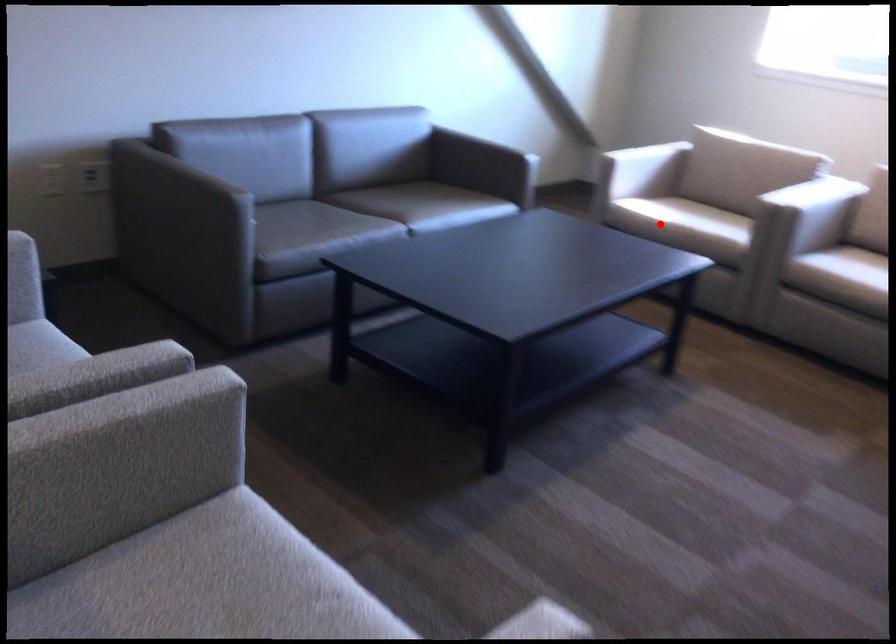
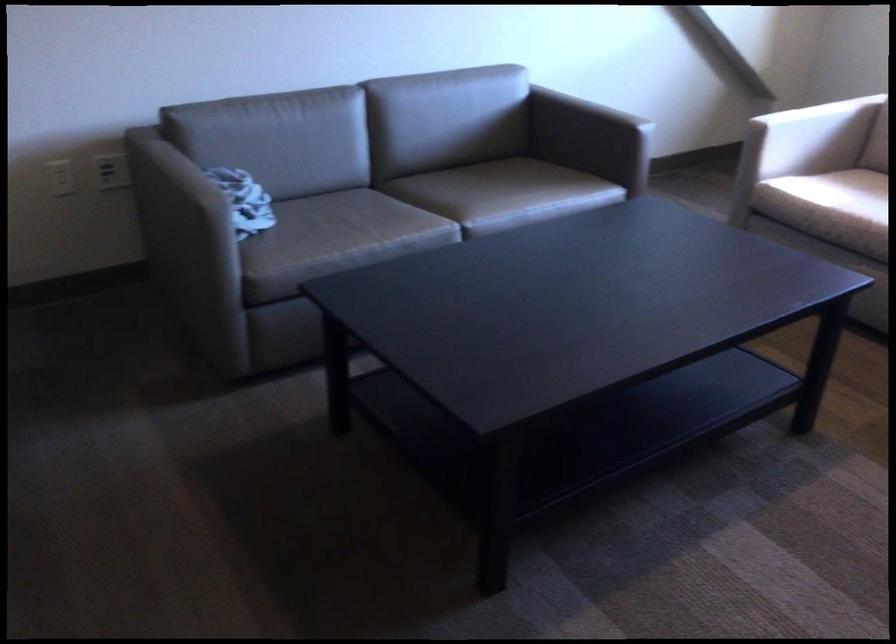
Find the pixel in the second image that matches the highlighted location in the first image.

(821, 216)